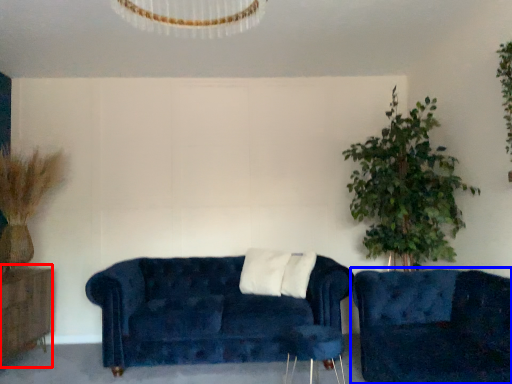
Question: Which point is further to the camera, dresser (highlighted by a red box) or studio couch (highlighted by a blue box)?

Choices:
 (A) dresser
 (B) studio couch

Answer: (A)